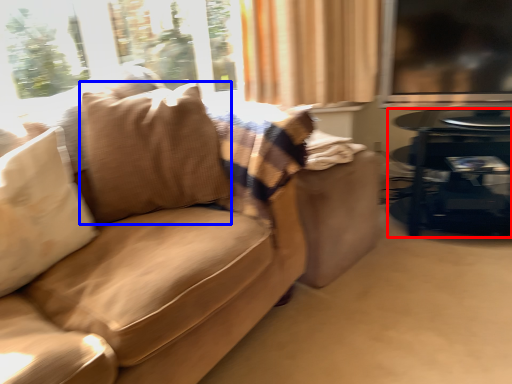
Question: Which object appears closest to the camera in this image, table (highlighted by a red box) or throw pillow (highlighted by a blue box)?

Choices:
 (A) table
 (B) throw pillow

Answer: (B)